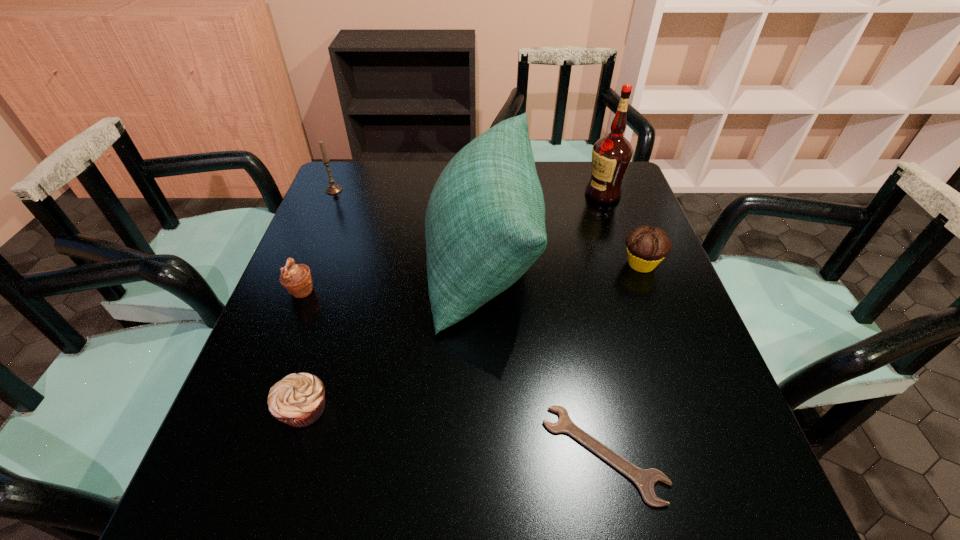
Identify the location of alcohol. The width and height of the screenshot is (960, 540). (611, 155).

At what (x,y) coordinates should I click in order to perform the action: click on the sixth shortest object. Please return your answer as a coordinate pair (x, y). Looking at the image, I should click on (485, 220).

At what (x,y) coordinates should I click in order to perform the action: click on candle. Please return your answer as a coordinate pair (x, y). This screenshot has height=540, width=960. Looking at the image, I should click on (333, 188).

Locate an element on the screen. the rightmost muffin is located at coordinates (647, 246).

Locate an element on the screen. the leftmost muffin is located at coordinates (296, 278).

The image size is (960, 540). Find the location of `the shortest muffin`. the shortest muffin is located at coordinates click(x=298, y=400).

I want to click on the second shortest object, so click(x=298, y=400).

Locate an element on the screen. The height and width of the screenshot is (540, 960). the shortest object is located at coordinates (645, 479).

Locate an element on the screen. The width and height of the screenshot is (960, 540). vacant region located on the label of the alcohol is located at coordinates [559, 194].

Where is `blank area located 0.280m on the label of the alcohol`? This screenshot has width=960, height=540. blank area located 0.280m on the label of the alcohol is located at coordinates (492, 194).